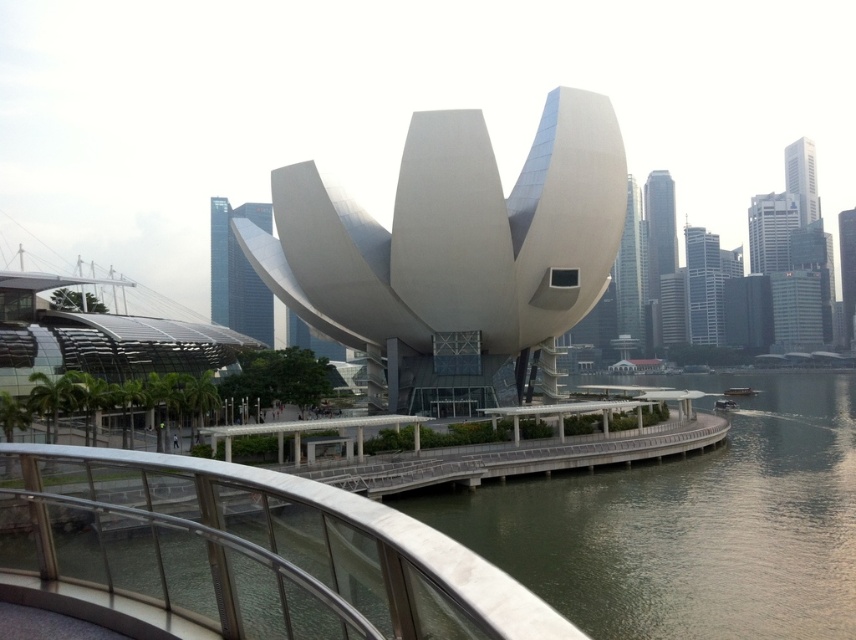
The height and width of the screenshot is (640, 856). Identify the location of silver metallic bridge at lower center. point(253,550).

Is point (343, 500) closer to camera compared to point (503, 477)?

Yes, point (343, 500) is in front of point (503, 477).

The height and width of the screenshot is (640, 856). I want to click on silver metallic bridge at lower center, so click(253, 550).

Who is more forward, (506, 365) or (51, 544)?

Point (51, 544) is in front.

Between white smooth building at center and silver metallic bridge at lower center, which one is positioned lower?

silver metallic bridge at lower center is below.

Does point (462, 118) come in front of point (76, 458)?

No, (462, 118) is behind (76, 458).

At what (x,y) coordinates should I click in order to perform the action: click on white smooth building at center. Please return your answer as a coordinate pair (x, y). The width and height of the screenshot is (856, 640). Looking at the image, I should click on (455, 252).

Does point (586, 282) come farther from viewer compared to point (221, 435)?

Yes, point (586, 282) is farther from viewer.

Who is more forward, (437,225) or (522,452)?

Point (522,452) is more forward.

Between point (524, 282) and point (437, 456), which one is positioned behind?

The point (524, 282) is behind.

You are a GUI agent. You are given a task and a screenshot of the screen. Output one action in this format:
    pyautogui.click(x=<x>, y=<y>)
    Task: Click on the white smooth building at center
    This screenshot has width=856, height=640.
    Given the screenshot: What is the action you would take?
    [455, 252]